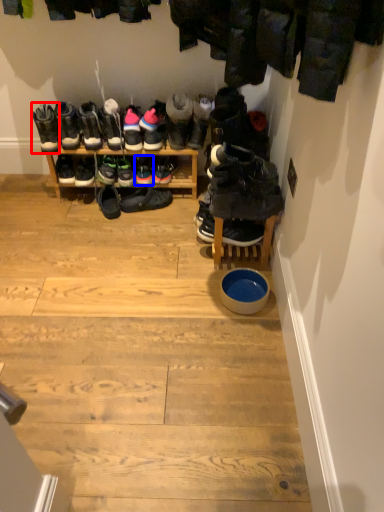
Question: Among these objects, which one is nearest to the camera, footwear (highlighted by a red box) or footwear (highlighted by a blue box)?

Choices:
 (A) footwear
 (B) footwear

Answer: (A)